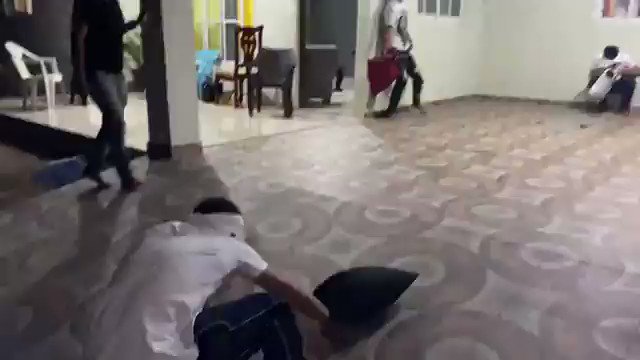
What are the coordinates of `black wall` in the screenshot? It's located at (45, 40).